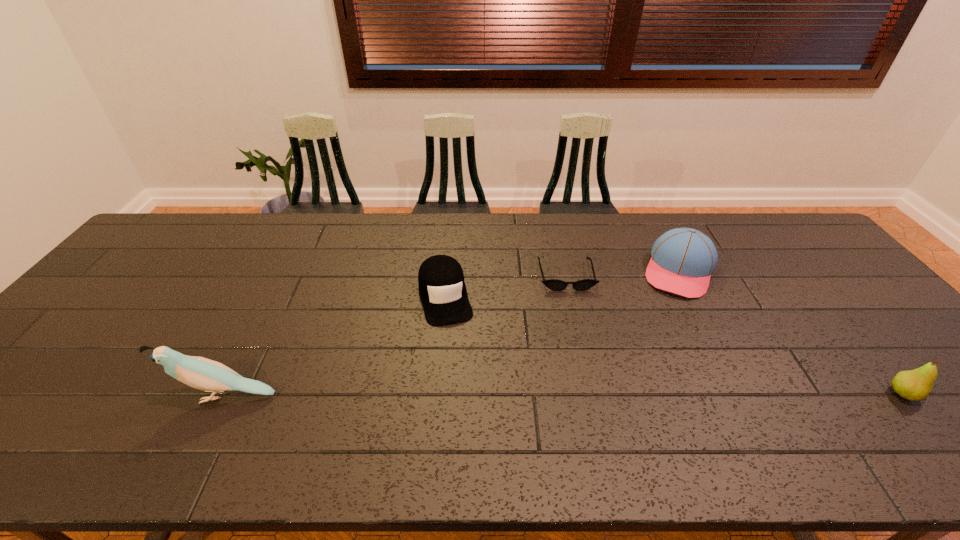
The image size is (960, 540). I want to click on free space on the desktop that is between the leftmost object and the pear and is positioned on the front-facing side of the shortest object, so click(x=593, y=395).

At what (x,y) coordinates should I click in order to perform the action: click on free space on the desktop that is between the tallest object and the rightmost object and is positioned on the front-facing side of the baseball cap. Please return your answer as a coordinate pair (x, y). Looking at the image, I should click on (643, 395).

This screenshot has height=540, width=960. I want to click on vacant space on the desktop that is between the tallest object and the pear and is positioned on the front-facing side of the second object from left to right, so click(470, 395).